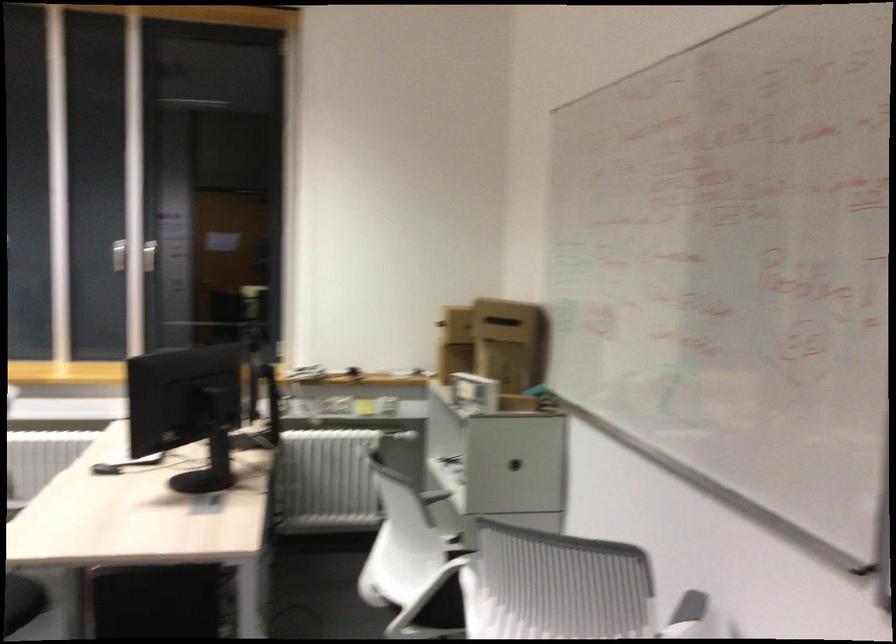
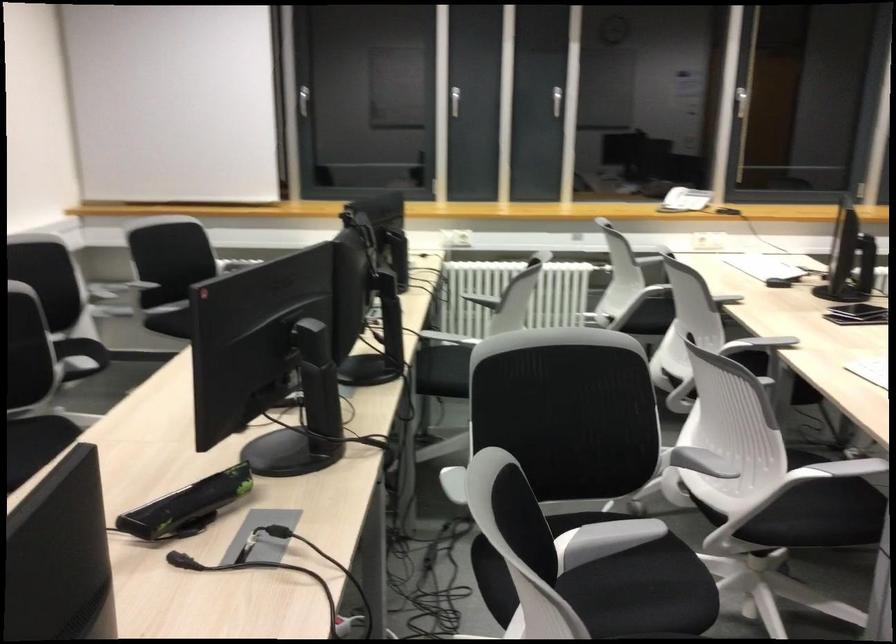
Question: Which direction would the cameraman need to move to produce the second image? Reply with the corresponding letter.

Choices:
 (A) Left
 (B) Right
 (C) Forward
 (D) Backward

Answer: (A)